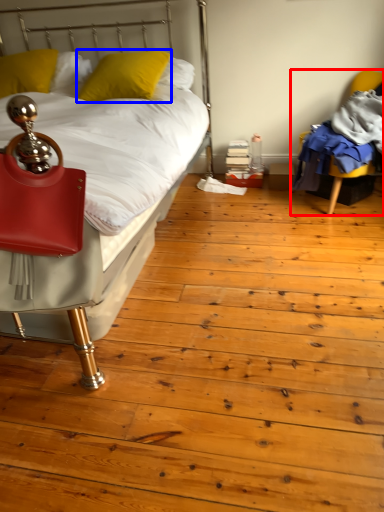
Question: Among these objects, which one is nearest to the camera, chair (highlighted by a red box) or pillow (highlighted by a blue box)?

Choices:
 (A) chair
 (B) pillow

Answer: (A)